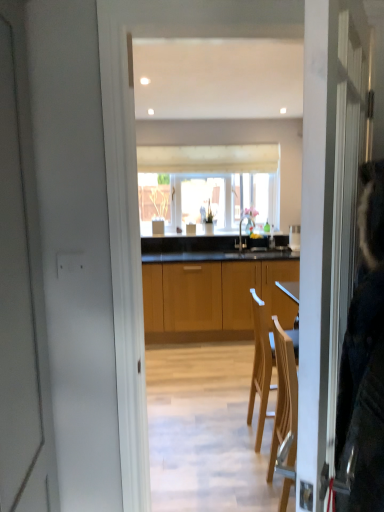
Question: Is wooden cabinets at center bigger than white fabric window at center?

Choices:
 (A) yes
 (B) no

Answer: (A)

Question: Is wooden cabinets at center at the left side of white fabric window at center?

Choices:
 (A) yes
 (B) no

Answer: (B)

Question: Is wooden cabinets at center further to camera compared to white fabric window at center?

Choices:
 (A) yes
 (B) no

Answer: (B)

Question: Can white fabric window at center be found inside wooden cabinets at center?

Choices:
 (A) no
 (B) yes

Answer: (A)

Question: Is wooden cabinets at center thinner than white fabric window at center?

Choices:
 (A) yes
 (B) no

Answer: (B)

Question: From their relative heights in the image, would you say wooden cabinets at center is taller or shorter than white fabric window at center?

Choices:
 (A) tall
 (B) short

Answer: (A)

Question: Is wooden cabinets at center spatially inside white fabric window at center, or outside of it?

Choices:
 (A) outside
 (B) inside

Answer: (A)

Question: From the image's perspective, is wooden cabinets at center located above or below white fabric window at center?

Choices:
 (A) above
 (B) below

Answer: (B)

Question: Does point pyautogui.click(x=236, y=287) appear closer or farther from the camera than point pyautogui.click(x=226, y=212)?

Choices:
 (A) closer
 (B) farther

Answer: (A)

Question: From a real-world perspective, is white fabric window at center physically located above or below white glossy kettle at center?

Choices:
 (A) below
 (B) above

Answer: (B)

Question: Is white fabric window at center inside the boundaries of white glossy kettle at center, or outside?

Choices:
 (A) inside
 (B) outside

Answer: (B)

Question: Is white fabric window at center wider or thinner than white glossy kettle at center?

Choices:
 (A) wide
 (B) thin

Answer: (A)

Question: Is white fabric window at center to the left or to the right of white glossy kettle at center in the image?

Choices:
 (A) left
 (B) right

Answer: (A)

Question: Does point (243, 217) appear closer or farther from the camera than point (294, 308)?

Choices:
 (A) closer
 (B) farther

Answer: (B)

Question: Relative to wooden cabinets at center, is matte silver faucet at center in front or behind?

Choices:
 (A) behind
 (B) front

Answer: (A)